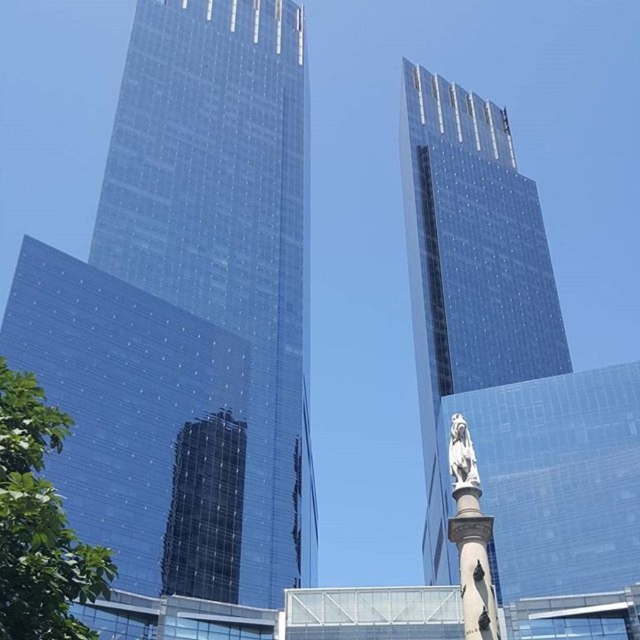
Can you confirm if transparent glass tower at left is smaller than transparent glass skyscraper at center?

No, transparent glass tower at left is not smaller than transparent glass skyscraper at center.

Which of these two, transparent glass tower at left or transparent glass skyscraper at center, stands taller?

With more height is transparent glass tower at left.

What are the coordinates of `transparent glass tower at left` in the screenshot? It's located at (188, 312).

Is transparent glass tower at left to the right of white marble statue at center from the viewer's perspective?

In fact, transparent glass tower at left is to the left of white marble statue at center.

Does point (284, 481) lie behind point (456, 433)?

Yes, point (284, 481) is behind point (456, 433).

Find the location of a particular element. transparent glass tower at left is located at coordinates (188, 312).

Does transparent glass skyscraper at center come behind white marble statue at center?

Yes, it is behind white marble statue at center.

Can you confirm if transparent glass skyscraper at center is positioned to the right of white marble statue at center?

Yes, transparent glass skyscraper at center is to the right of white marble statue at center.

The height and width of the screenshot is (640, 640). What are the coordinates of `transparent glass skyscraper at center` in the screenshot? It's located at (468, 268).

This screenshot has height=640, width=640. Identify the location of transparent glass skyscraper at center. (468, 268).